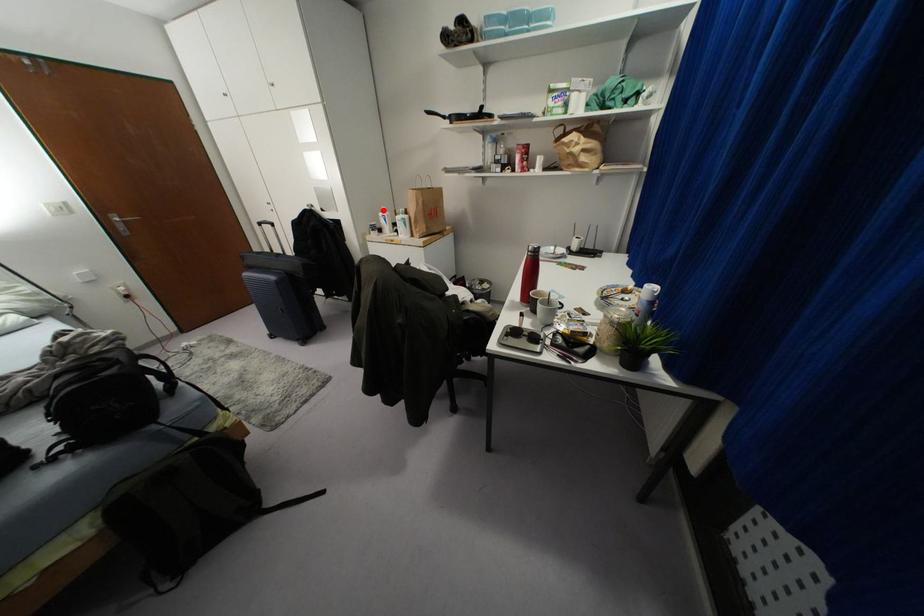
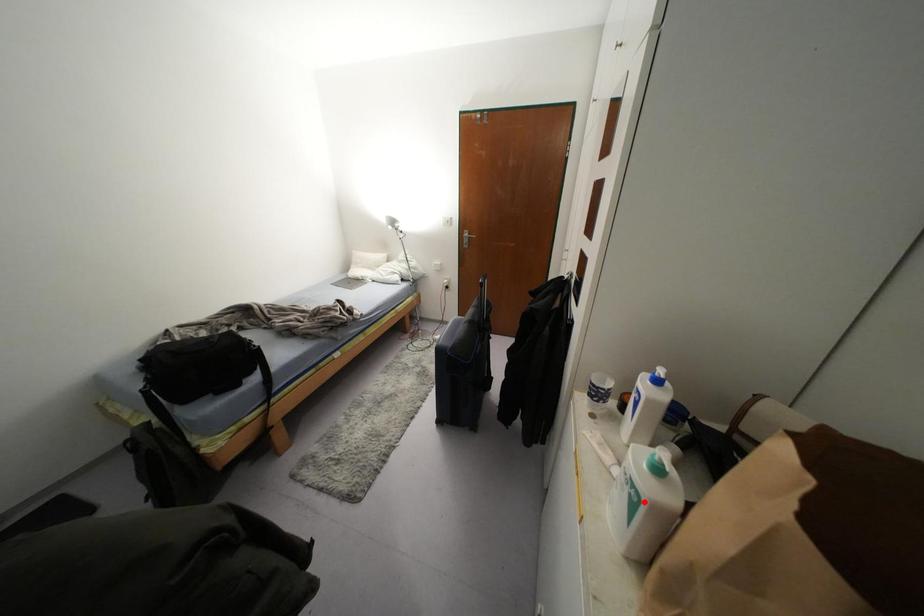
I am providing you with two images of the same scene from different viewpoints. A red point is marked on the first image and another point is marked on the second image. Is the marked point in image1 the same physical position as the marked point in image2?

No